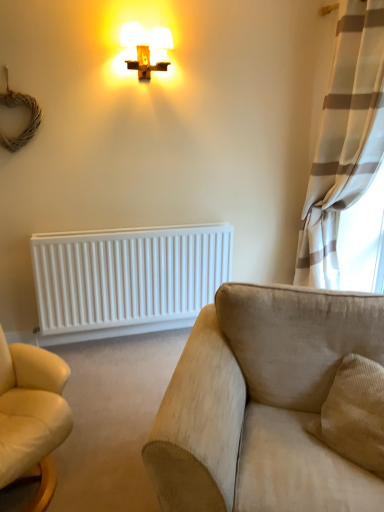
Question: From the image's perspective, relative to beige fabric couch at lower right, is white matte radiator at lower left above or below?

Choices:
 (A) above
 (B) below

Answer: (A)

Question: Considering the positions of point (177, 239) and point (261, 395), is point (177, 239) closer or farther from the camera than point (261, 395)?

Choices:
 (A) farther
 (B) closer

Answer: (A)

Question: Based on their relative distances, which object is farther from the white textured curtain at right?

Choices:
 (A) matte gold cross at upper center
 (B) beige fabric couch at lower right
 (C) white matte radiator at lower left

Answer: (B)

Question: Estimate the real-world distances between objects in this image. Which object is closer to the beige fabric couch at lower right?

Choices:
 (A) white matte radiator at lower left
 (B) matte gold cross at upper center
 (C) white textured curtain at right

Answer: (A)